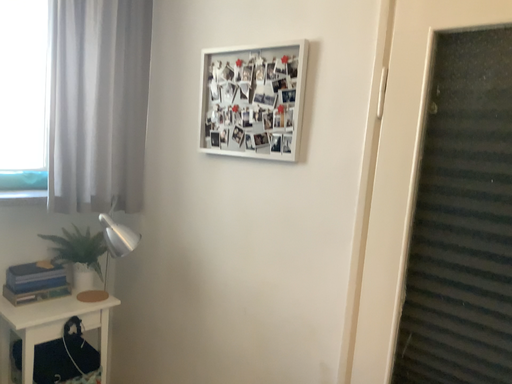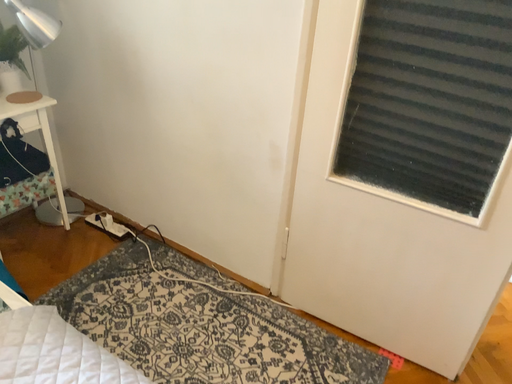
Question: Which way did the camera rotate in the video?

Choices:
 (A) rotated left
 (B) rotated right

Answer: (B)